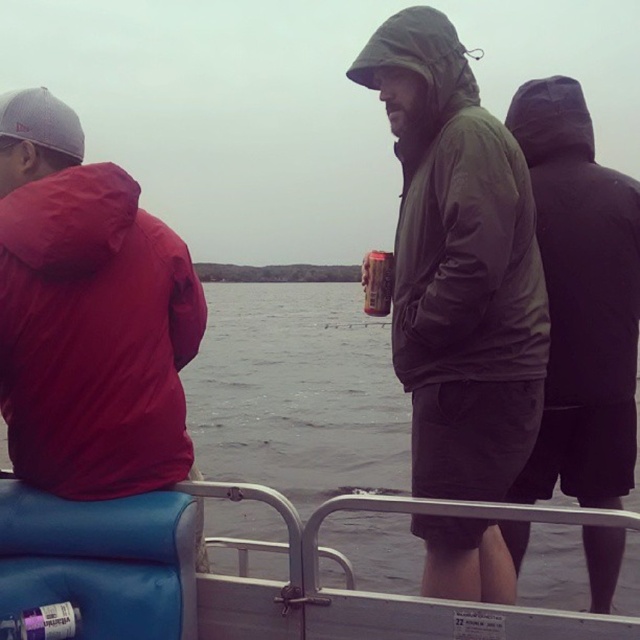
Question: Is dark matte jacket at center below metallic can at center?

Choices:
 (A) yes
 (B) no

Answer: (A)

Question: Can you confirm if matte green jacket at center is positioned to the right of matte red jacket at left?

Choices:
 (A) yes
 (B) no

Answer: (A)

Question: Among these points, which one is farthest from the camera?

Choices:
 (A) (104, 630)
 (B) (342, 316)
 (C) (406, 202)
 (D) (113, 211)

Answer: (B)

Question: Which of these objects is positioned closest to the matte red jacket at left?

Choices:
 (A) gray water at center
 (B) metallic can at center
 (C) dark matte jacket at center

Answer: (B)

Question: Is matte red jacket at left closer to the viewer compared to dark matte jacket at center?

Choices:
 (A) yes
 (B) no

Answer: (A)

Question: Estimate the real-world distances between objects in this image. Which object is closer to the blue vinyl seat at lower left?

Choices:
 (A) matte green jacket at center
 (B) dark matte jacket at center

Answer: (A)